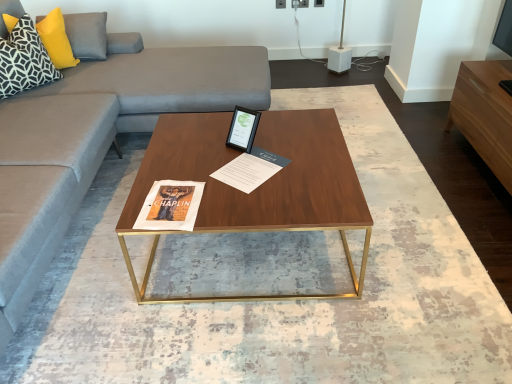
Where is `free spot in front of wooden polished coffee table at center`? Image resolution: width=512 pixels, height=384 pixels. free spot in front of wooden polished coffee table at center is located at coordinates (254, 338).